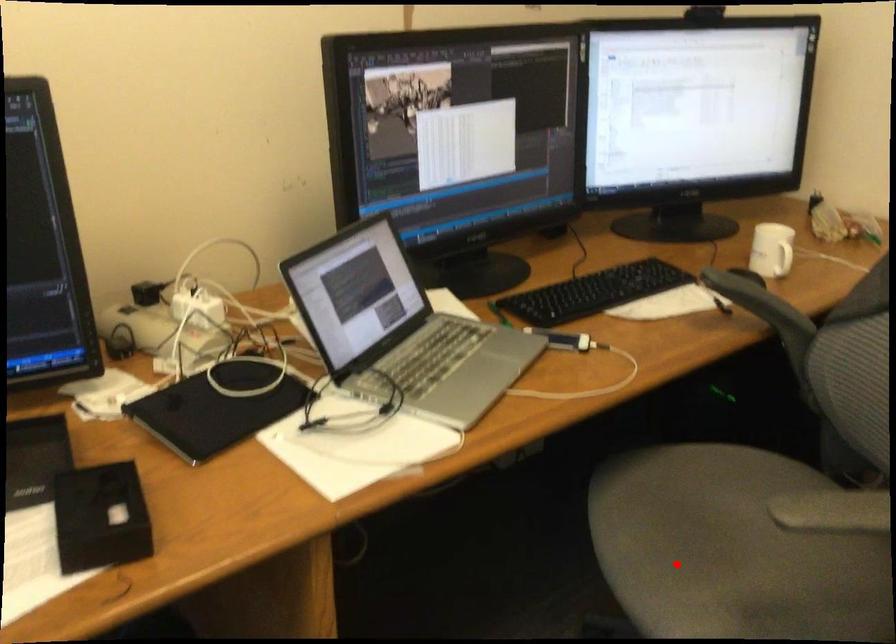
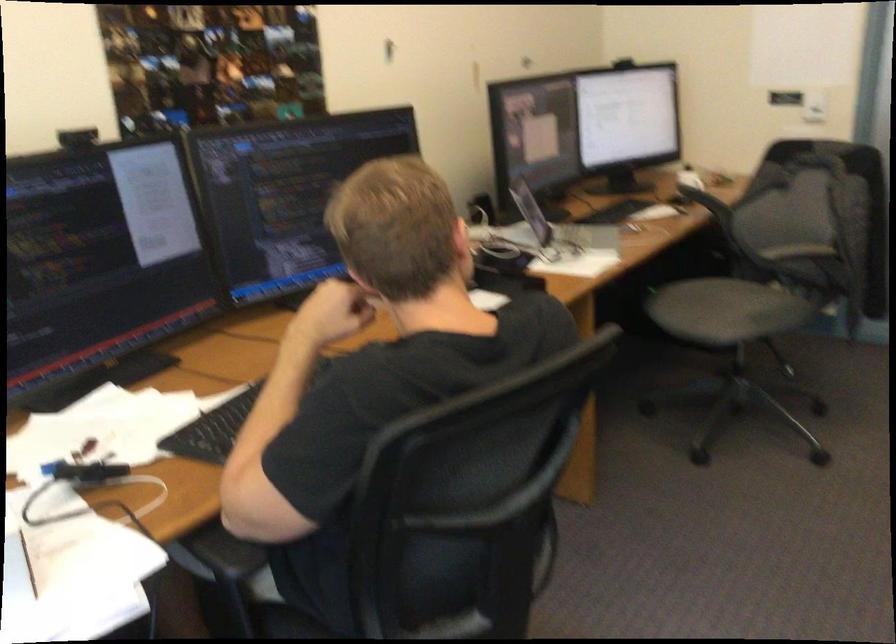
Question: I am providing you with two images of the same scene from different viewpoints. Given a red point in image1, look at the same physical point in image2. Is it:

Choices:
 (A) Closer to the viewpoint
 (B) Farther from the viewpoint

Answer: (B)